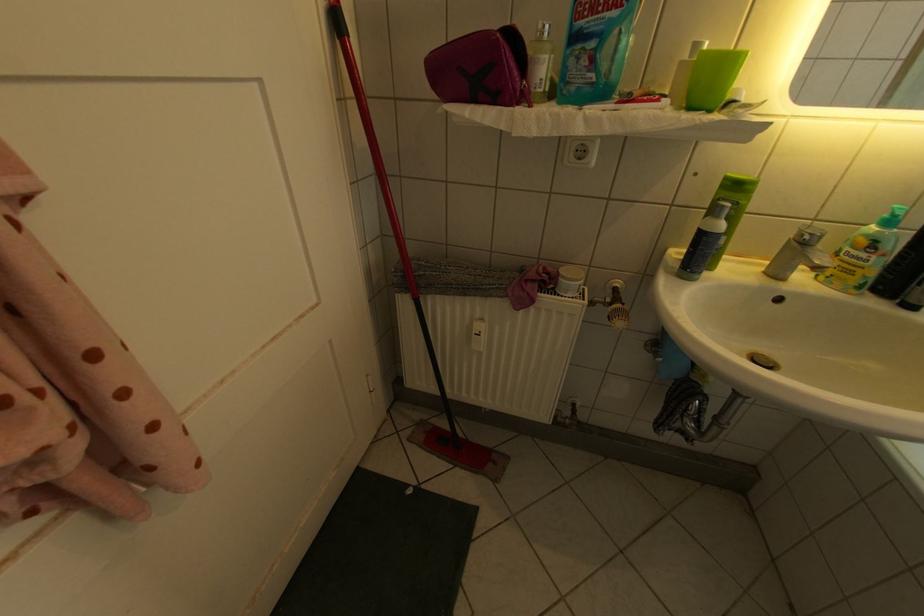
Find where to push the white pump dispenser. Please return your answer as a coordinate pair (x, y).

(684, 74)